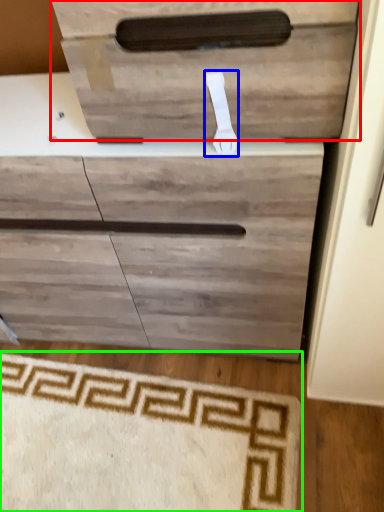
Question: Considering the real-world distances, which object is closest to drawer (highlighted by a red box)? door handle (highlighted by a blue box) or doormat (highlighted by a green box).

Choices:
 (A) door handle
 (B) doormat

Answer: (A)